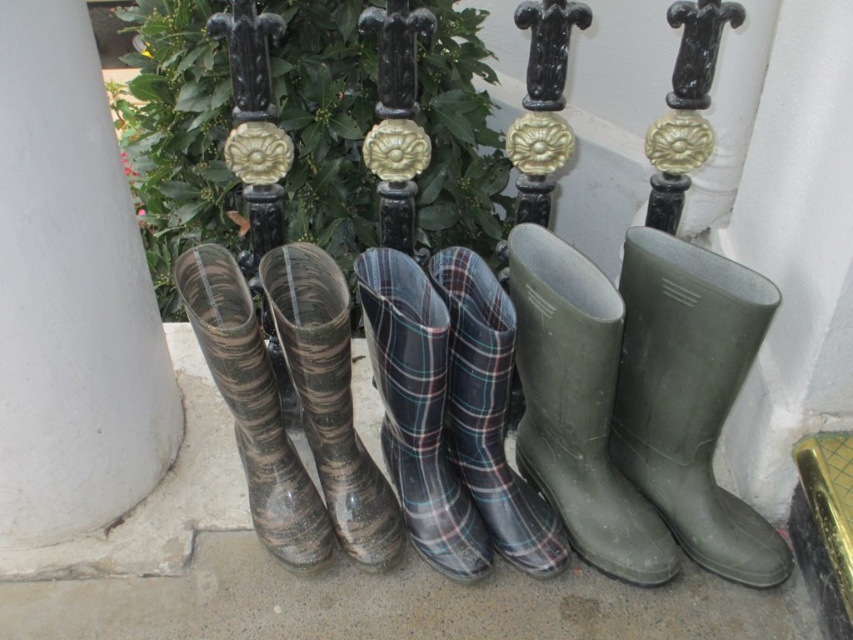
You need to choose a pair of boots to wear in the muddy garden. The camouflage rubber boots at left are your usual size, but the green rubber boot at right is a different size. Which pair would you pick and why?

The green rubber boot at right is bigger than the camouflage rubber boots at left. Since the green rubber boot at right is larger, it might provide better coverage in muddy conditions, so you should pick the green rubber boot at right.

From the picture: You are trying to choose between the green rubber boot at center and the plaid rubber boots at center for a rainy day. Which one would provide better ankle support based on their height?

The green rubber boot at center is much taller than the plaid rubber boots at center, so it would provide better ankle support.